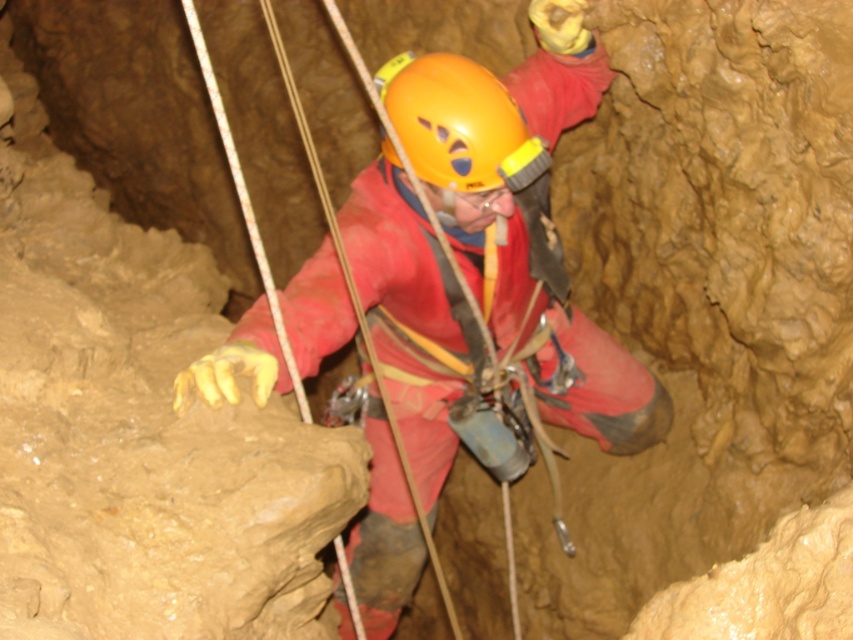
You are a drone operator guiding a drone through a cave. The drone is currently at the entrance and needs to reach the matte red jumpsuit at center. Based on the coordinates provided, in which general direction should the drone move to reach the jumpsuit?

The matte red jumpsuit at center is located at coordinates point (494, 221). Since the drone is at the entrance, it should move towards the center of the cave to reach the jumpsuit.

You are a safety inspector reviewing the caving setup. The matte red jumpsuit at center and the orange matte helmet at center must be visible to each other for safety. Given their sizes, which object is easier to spot from a distance?

The matte red jumpsuit at center is larger in size compared to the orange matte helmet at center, making it easier to spot from a distance.

You are a caving guide preparing to lead a group through the cave. You notice the matte red jumpsuit at center and the orange matte helmet at center. Which piece of equipment is positioned to the right of the other?

The matte red jumpsuit at center is positioned on the right side of orange matte helmet at center, so the jumpsuit is to the right of the helmet.